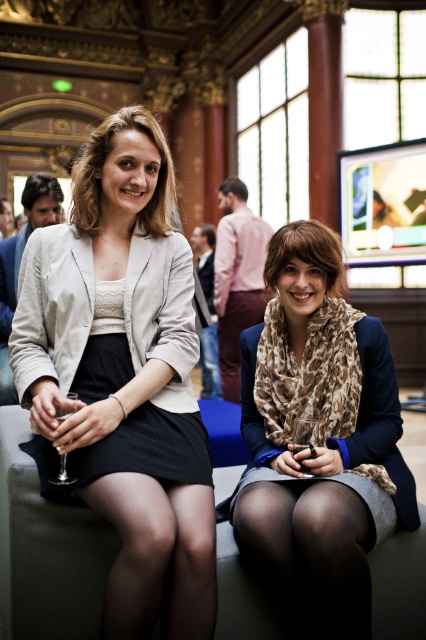
Question: Which point is closer to the camera taking this photo?

Choices:
 (A) (302, 579)
 (B) (28, 184)

Answer: (A)

Question: Does matte beige blazer at center have a smaller size compared to matte beige blazer at upper left?

Choices:
 (A) no
 (B) yes

Answer: (B)

Question: Can you confirm if leopard print scarf at center is positioned below matte beige blazer at upper left?

Choices:
 (A) no
 (B) yes

Answer: (B)

Question: Is brown hair scarf at center to the right of matte black hair at upper left from the viewer's perspective?

Choices:
 (A) yes
 (B) no

Answer: (A)

Question: Which object is the closest to the matte beige blazer at upper left?

Choices:
 (A) matte black hair at upper left
 (B) brown hair scarf at center
 (C) matte beige blazer at center
 (D) matte beige dress at center

Answer: (C)

Question: Which point is farther to the camera?

Choices:
 (A) (163, 445)
 (B) (181, 420)

Answer: (B)